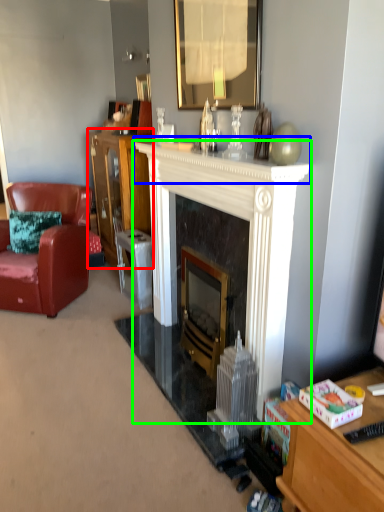
Question: Estimate the real-world distances between objects in this image. Which object is closer to cabinetry (highlighted by a red box), mantle (highlighted by a blue box) or fireplace (highlighted by a green box)?

Choices:
 (A) mantle
 (B) fireplace

Answer: (A)